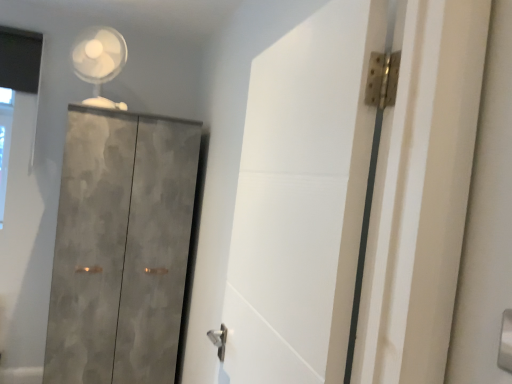
Question: From the image's perspective, is textured concrete cupboard at left beneath white plastic fan at upper left?

Choices:
 (A) yes
 (B) no

Answer: (A)

Question: Does textured concrete cupboard at left turn towards white plastic fan at upper left?

Choices:
 (A) yes
 (B) no

Answer: (B)

Question: Is textured concrete cupboard at left behind white plastic fan at upper left?

Choices:
 (A) no
 (B) yes

Answer: (A)

Question: Can you confirm if textured concrete cupboard at left is smaller than white plastic fan at upper left?

Choices:
 (A) yes
 (B) no

Answer: (B)

Question: From a real-world perspective, is textured concrete cupboard at left under white plastic fan at upper left?

Choices:
 (A) yes
 (B) no

Answer: (A)

Question: Choose the correct answer: Is white matte door at center inside white plastic fan at upper left or outside it?

Choices:
 (A) inside
 (B) outside

Answer: (B)

Question: Does point (274, 380) appear closer or farther from the camera than point (93, 91)?

Choices:
 (A) farther
 (B) closer

Answer: (B)

Question: Is white matte door at center to the left or to the right of white plastic fan at upper left in the image?

Choices:
 (A) right
 (B) left

Answer: (A)

Question: Looking at their shapes, would you say white matte door at center is wider or thinner than white plastic fan at upper left?

Choices:
 (A) thin
 (B) wide

Answer: (A)

Question: Considering the relative positions of white plastic fan at upper left and white matte door at center in the image provided, is white plastic fan at upper left to the left or to the right of white matte door at center?

Choices:
 (A) left
 (B) right

Answer: (A)

Question: From their relative heights in the image, would you say white plastic fan at upper left is taller or shorter than white matte door at center?

Choices:
 (A) tall
 (B) short

Answer: (B)

Question: From the image's perspective, is white plastic fan at upper left positioned above or below white matte door at center?

Choices:
 (A) below
 (B) above

Answer: (B)

Question: From a real-world perspective, relative to white matte door at center, is white plastic fan at upper left vertically above or below?

Choices:
 (A) above
 (B) below

Answer: (A)

Question: From a real-world perspective, is white matte door at center physically located above or below textured concrete cupboard at left?

Choices:
 (A) above
 (B) below

Answer: (A)

Question: Looking at their shapes, would you say white matte door at center is wider or thinner than textured concrete cupboard at left?

Choices:
 (A) thin
 (B) wide

Answer: (A)